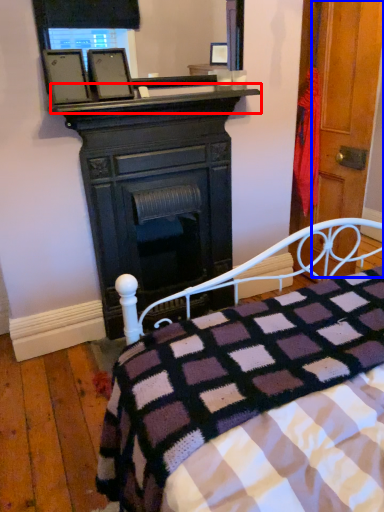
Question: Which object appears farthest to the camera in this image, mantle (highlighted by a red box) or door (highlighted by a blue box)?

Choices:
 (A) mantle
 (B) door

Answer: (B)